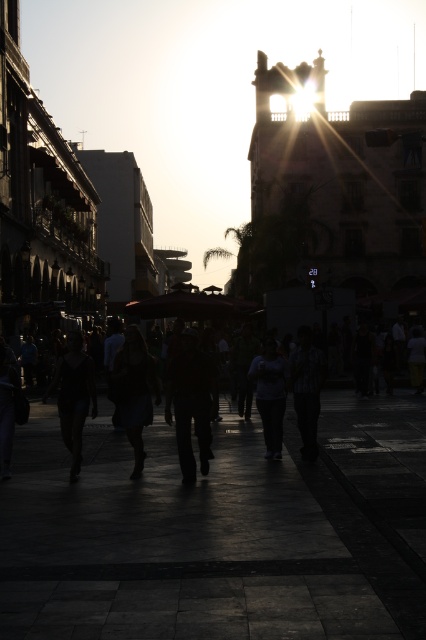
Is dark clothing at center closer to the viewer compared to dark blue jeans at center?

Yes, it is.

This screenshot has height=640, width=426. What are the coordinates of `dark clothing at center` in the screenshot? It's located at (x=189, y=403).

I want to click on dark clothing at center, so click(x=189, y=403).

Does dark stone pavement at center have a larger size compared to dark fabric shirt at center?

Yes, dark stone pavement at center is bigger than dark fabric shirt at center.

The height and width of the screenshot is (640, 426). Find the location of `dark stone pavement at center`. dark stone pavement at center is located at coordinates (219, 531).

Where is `dark stone pavement at center`? The width and height of the screenshot is (426, 640). dark stone pavement at center is located at coordinates (219, 531).

Locate an element on the screen. This screenshot has width=426, height=640. dark stone pavement at center is located at coordinates (219, 531).

Does point (354, 449) come behind point (316, 445)?

Yes.

Is silhouette pedestrians at center to the right of dark fabric shirt at center from the viewer's perspective?

In fact, silhouette pedestrians at center is to the left of dark fabric shirt at center.

In order to click on silhouette pedestrians at center in this screenshot , I will do `click(373, 445)`.